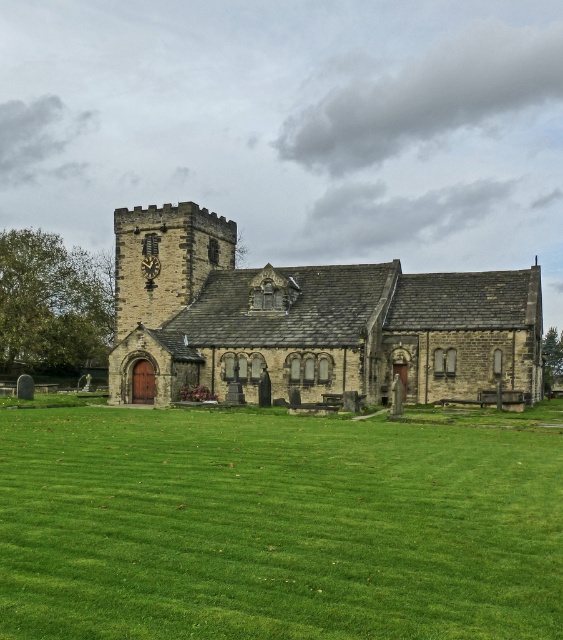
You are standing in a graveyard and see the green grass at center and the stone church at center. Which object is closer to the ground?

The green grass at center is closer to the ground because it is positioned under the stone church at center.

You are standing at the entrance of the traditional stone church with a clock tower on its left. You want to find the green grass at center. According to the coordinates provided, where should you look relative to the church?

The green grass at center is located at coordinates point (275, 525), which means it is positioned to the right and slightly forward of the church entrance.

You are standing in front of the church and want to walk towards the green grass at center. Which direction should you move relative to the stone church at center?

To reach the green grass at center, you should move to the left side of the stone church at center since the green grass at center is located to its left.